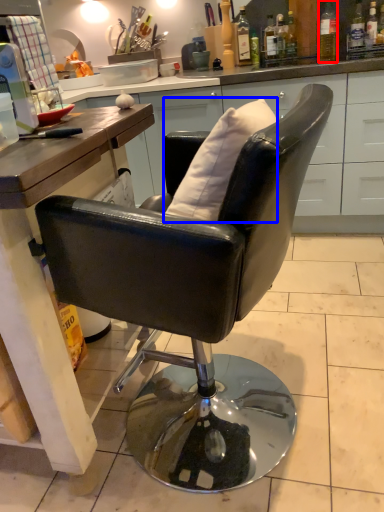
Question: Which point is closer to the camera, bottle (highlighted by a red box) or pillow (highlighted by a blue box)?

Choices:
 (A) bottle
 (B) pillow

Answer: (B)